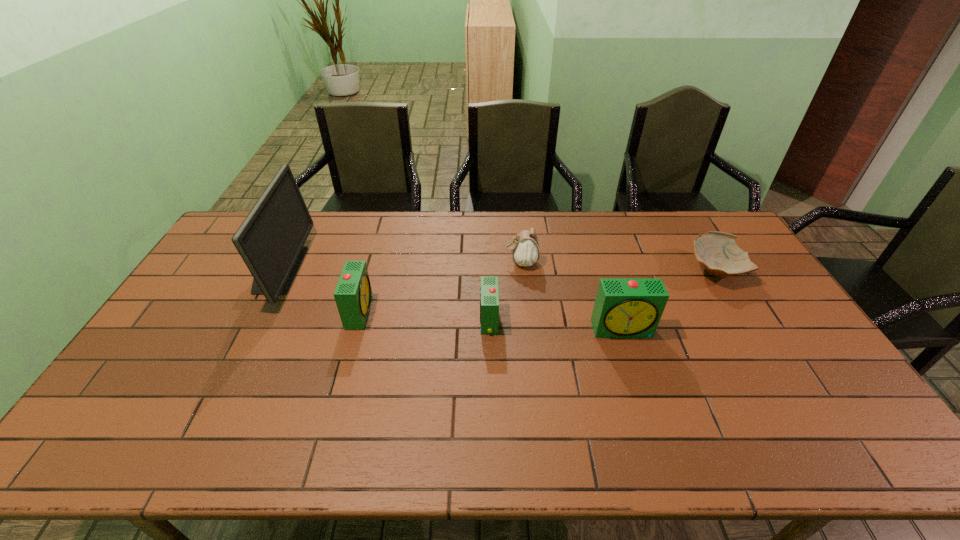
Where is `vacant space that satisfies the following two spatial constraints: 1. on the screen side of the computer monitor; 2. on the right side of the rightmost object`? This screenshot has width=960, height=540. vacant space that satisfies the following two spatial constraints: 1. on the screen side of the computer monitor; 2. on the right side of the rightmost object is located at coordinates click(278, 270).

Where is `blank area in the image that satisfies the following two spatial constraints: 1. on the screen side of the shortest object; 2. on the left side of the leftmost object`? The image size is (960, 540). blank area in the image that satisfies the following two spatial constraints: 1. on the screen side of the shortest object; 2. on the left side of the leftmost object is located at coordinates pyautogui.click(x=278, y=270).